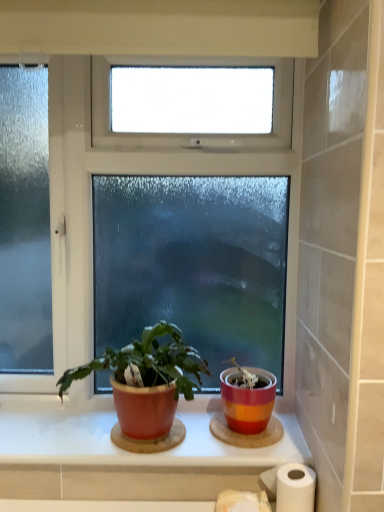
Question: From a real-world perspective, is white matte toilet paper at lower center physically located above or below white paper at lower right?

Choices:
 (A) below
 (B) above

Answer: (A)

Question: Is point (251, 506) positioned closer to the camera than point (294, 475)?

Choices:
 (A) closer
 (B) farther

Answer: (B)

Question: Estimate the real-world distances between objects in this image. Which object is closer to the striped ceramic pot at center?

Choices:
 (A) clear glass window at center
 (B) matte red pot at center
 (C) white matte toilet paper at lower center
 (D) matte ceramic window sill at center
 (E) white paper at lower right

Answer: (E)

Question: Which object is positioned farthest from the matte ceramic window sill at center?

Choices:
 (A) clear glass window at center
 (B) matte red pot at center
 (C) white matte toilet paper at lower center
 (D) striped ceramic pot at center
 (E) white paper at lower right

Answer: (A)